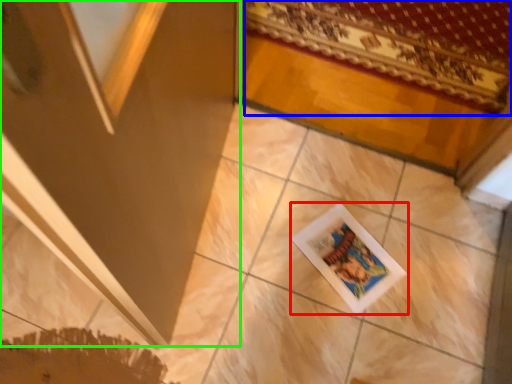
Question: Which object is positioned closest to picture frame (highlighted by a red box)? Select from mat (highlighted by a blue box) and screen door (highlighted by a green box).

Choices:
 (A) mat
 (B) screen door

Answer: (B)